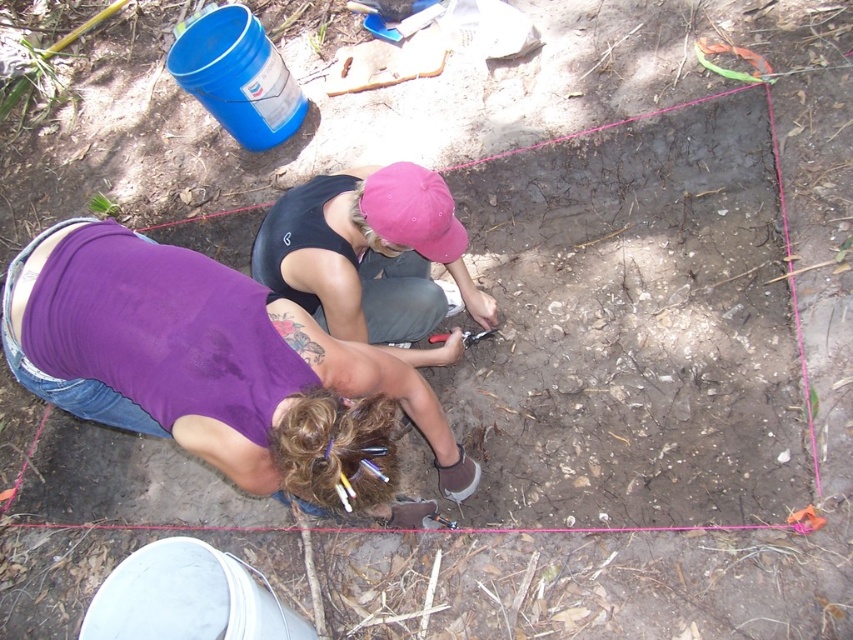
The width and height of the screenshot is (853, 640). What do you see at coordinates (215, 369) in the screenshot?
I see `purple fabric shirt at lower left` at bounding box center [215, 369].

Can you confirm if purple fabric shirt at lower left is positioned above pink fabric cap at center?

No, purple fabric shirt at lower left is not above pink fabric cap at center.

What do you see at coordinates (215, 369) in the screenshot? I see `purple fabric shirt at lower left` at bounding box center [215, 369].

Image resolution: width=853 pixels, height=640 pixels. I want to click on purple fabric shirt at lower left, so click(x=215, y=369).